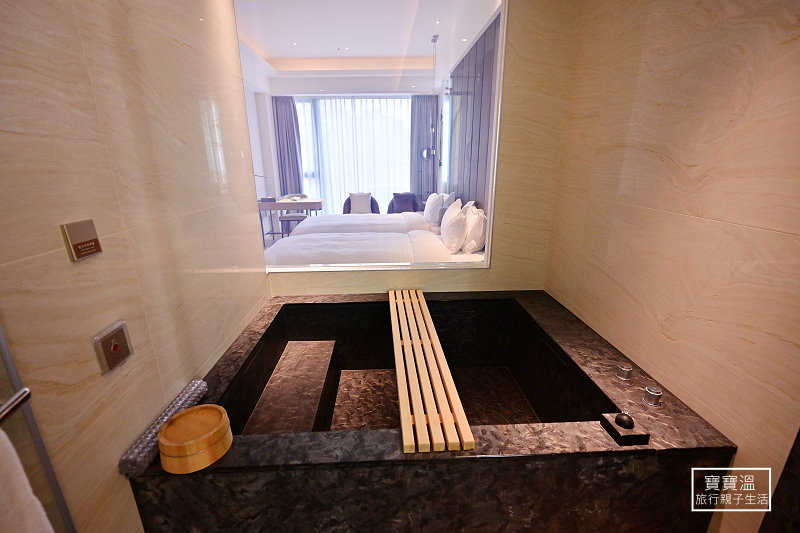
Locate an element on the screen. window is located at coordinates pos(354,130).